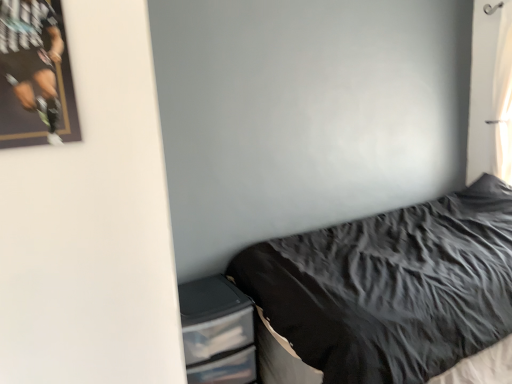
At what (x,y) coordinates should I click in order to perform the action: click on free space above clear plastic drawers at lower left (from a real-world perspective). Please return your answer as a coordinate pair (x, y). The image size is (512, 384). Looking at the image, I should click on (204, 291).